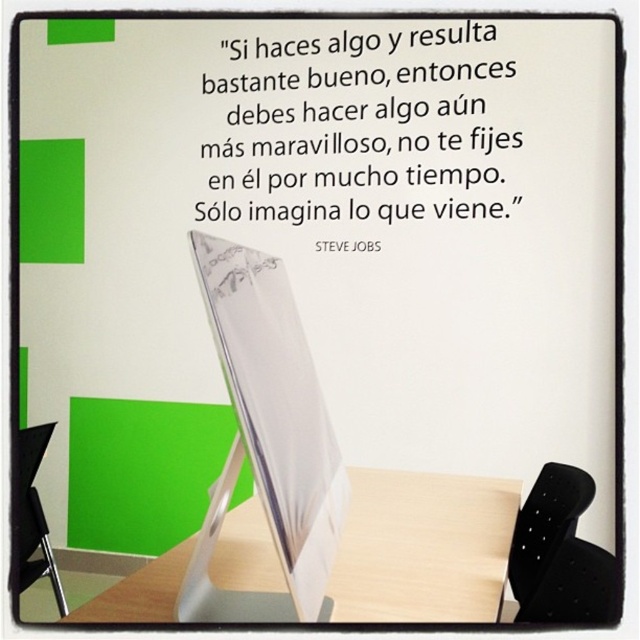
From the picture: You are setting up a workspace and want to place a silver metallic computer screen at center on top of a wooden table at center. Is there enough space between them for this placement?

The silver metallic computer screen at center is 13.11 inches away from wooden table at center. Since the screen is meant to be placed on the table, the distance between them suggests they are separate objects. Therefore, there is sufficient space to place the silver metallic computer screen at center on the wooden table at center.

You are organizing a tech conference and need to place a large banner between the silver metallic computer screen at center and the wooden table at center. Based on their positions, where should you place the banner?

The silver metallic computer screen at center is to the left of the wooden table at center, so you should place the banner to the right of the wooden table at center to ensure it is between both objects.